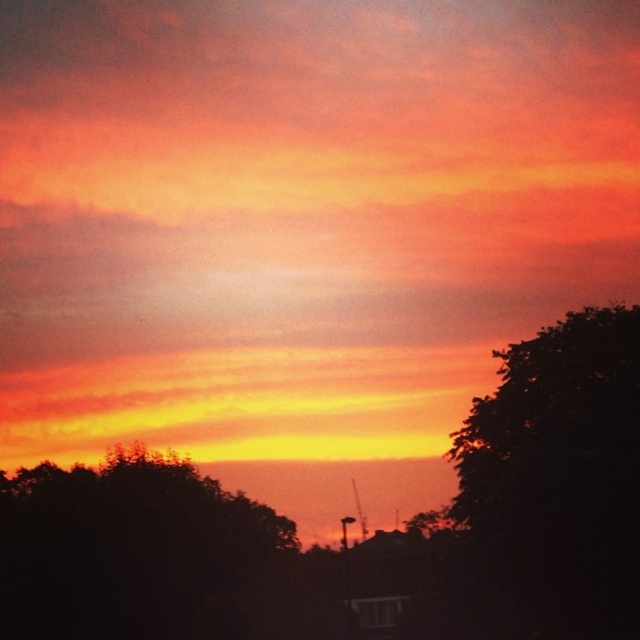
Is dark green leafy tree at right below silhouette tree at lower left?

Incorrect, dark green leafy tree at right is not positioned below silhouette tree at lower left.

Does point (576, 620) come farther from viewer compared to point (49, 512)?

No, it is in front of (49, 512).

The image size is (640, 640). I want to click on dark green leafy tree at right, so click(560, 474).